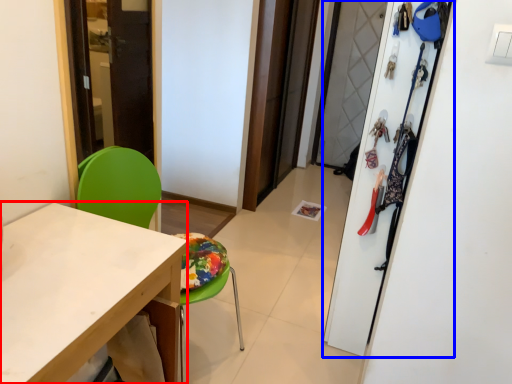
Question: Which object is closer to the camera taking this photo, desk (highlighted by a red box) or closet (highlighted by a blue box)?

Choices:
 (A) desk
 (B) closet

Answer: (A)